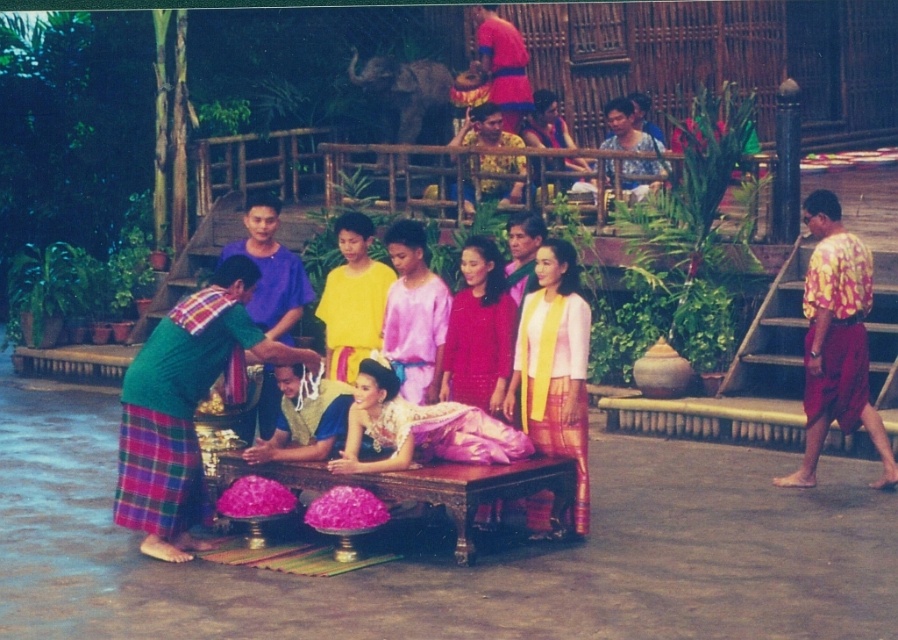
Is pink satin dress at center shorter than matte blue dress at upper center?

No.

Is pink satin dress at center bigger than matte blue dress at upper center?

No.

Is point (432, 384) farther from camera compared to point (629, 163)?

No, (432, 384) is in front of (629, 163).

Identify the location of pink satin dress at center. (414, 314).

Who is higher up, matte pink dress at center or matte pink fabric at upper center?

Positioned higher is matte pink fabric at upper center.

Based on the photo, between matte pink dress at center and matte pink fabric at upper center, which one has more height?

matte pink dress at center is taller.

The width and height of the screenshot is (898, 640). Describe the element at coordinates (480, 330) in the screenshot. I see `matte pink dress at center` at that location.

The width and height of the screenshot is (898, 640). I want to click on matte pink dress at center, so click(x=480, y=330).

Is yellow satin shirt at center wider than matte blue dress at upper center?

Correct, the width of yellow satin shirt at center exceeds that of matte blue dress at upper center.

Is yellow satin shirt at center below matte blue dress at upper center?

Indeed, yellow satin shirt at center is positioned under matte blue dress at upper center.

Find the location of `yellow satin shirt at center`. yellow satin shirt at center is located at coordinates (351, 298).

Where is `yellow satin shirt at center`? yellow satin shirt at center is located at coordinates (351, 298).